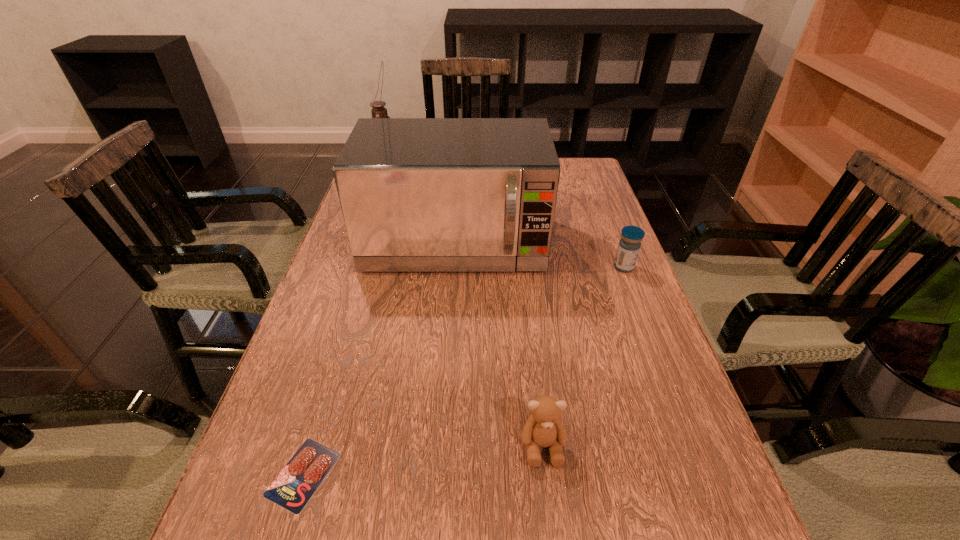
The height and width of the screenshot is (540, 960). Find the location of `vacant space located 0.070m on the back of the salami`. vacant space located 0.070m on the back of the salami is located at coordinates (325, 402).

This screenshot has height=540, width=960. Find the location of `object that is at the far edge`. object that is at the far edge is located at coordinates tap(378, 111).

At what (x,y) coordinates should I click in order to perform the action: click on oil lamp at the left edge. Please return your answer as a coordinate pair (x, y). Image resolution: width=960 pixels, height=540 pixels. Looking at the image, I should click on (378, 111).

Image resolution: width=960 pixels, height=540 pixels. What are the coordinates of `microwave oven that is at the left edge` in the screenshot? It's located at (417, 194).

Locate an element on the screen. salami situated at the left edge is located at coordinates (294, 486).

This screenshot has height=540, width=960. What are the coordinates of `object located at the right edge` in the screenshot? It's located at (629, 246).

Image resolution: width=960 pixels, height=540 pixels. I want to click on object positioned at the far left corner, so click(x=378, y=111).

The height and width of the screenshot is (540, 960). I want to click on vacant space at the left edge of the desktop, so click(x=311, y=428).

Where is `free location at the right edge`? The height and width of the screenshot is (540, 960). free location at the right edge is located at coordinates (575, 284).

In the image, there is a desktop. Identify the location of vacant region at the far right corner. Image resolution: width=960 pixels, height=540 pixels. (566, 179).